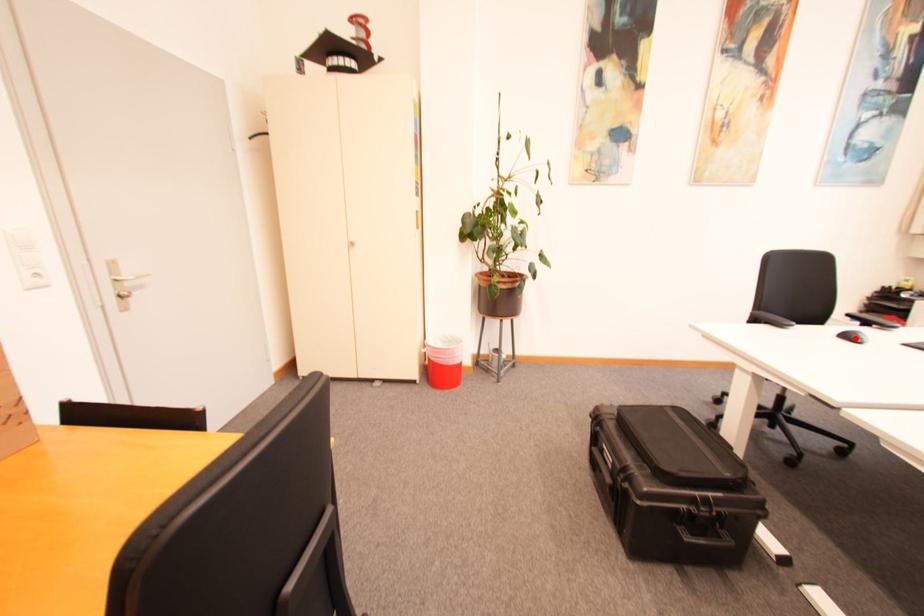
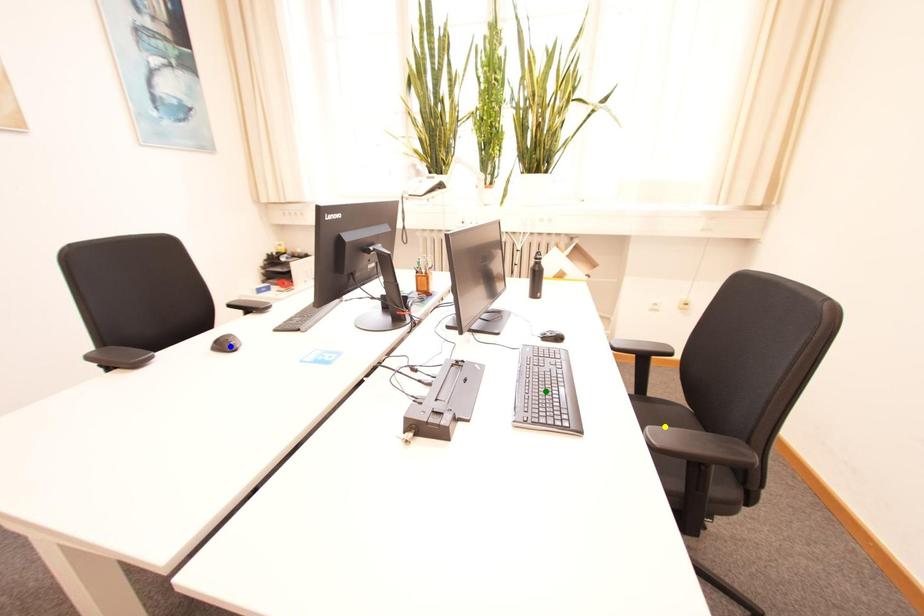
Question: I am providing you with two images of the same scene from different viewpoints. A red point is marked on the first image. You are given multiple points on the second image. Which spot in image 2 lines up with the point in image 1?

Choices:
 (A) green point
 (B) blue point
 (C) yellow point

Answer: (B)